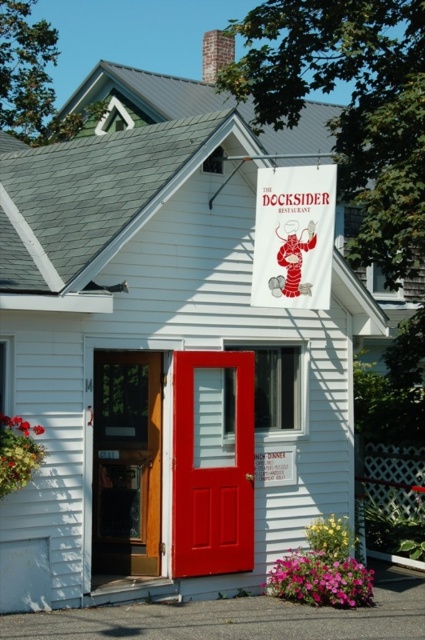
You are standing outside The Docksider Restaurant and want to read the sign hanging above the entrance. Can you see the white fabric sign at upper center through the wooden door at center?

The white fabric sign at upper center is behind the wooden door at center, so you cannot see the white fabric sign at upper center through the wooden door at center.

You are a delivery person with a 5 feet wide cart. You need to deliver a package to The Docksider Restaurant. The entrance has two doors. The matte red door at center and the white fabric sign at upper center are close to each other. Can your cart fit through the space between them?

The matte red door at center is 4.87 feet from the white fabric sign at upper center. Since your cart is 5 feet wide, it cannot fit through the space between them as the distance is slightly less than the cart width.